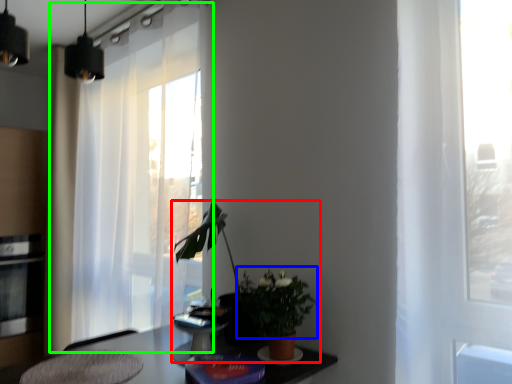
Question: Which is farther away from houseplant (highlighted by a red box)? floral arrangement (highlighted by a blue box) or curtain (highlighted by a green box)?

Choices:
 (A) floral arrangement
 (B) curtain

Answer: (B)